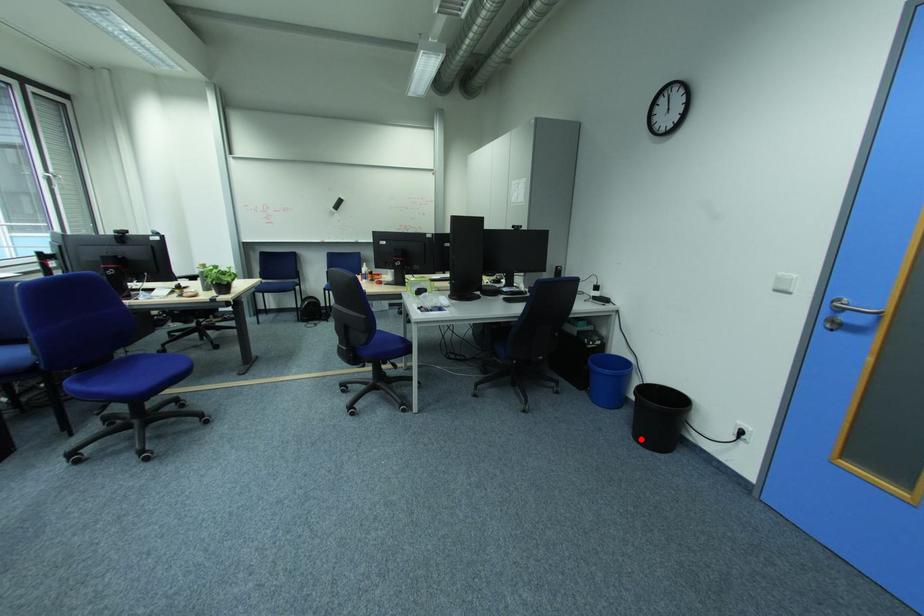
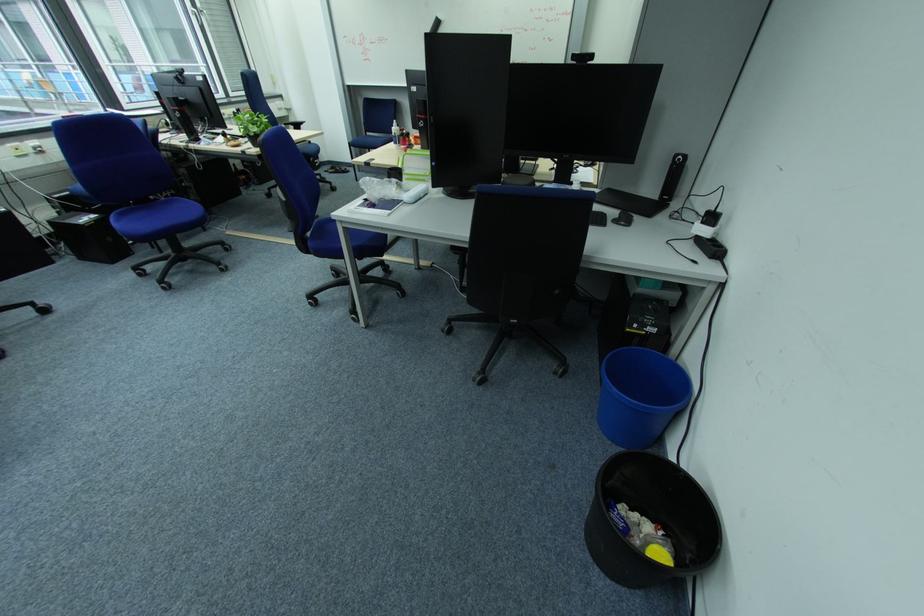
Where in the second image is the point corresponding to the highlighted location from the first image?

(596, 514)